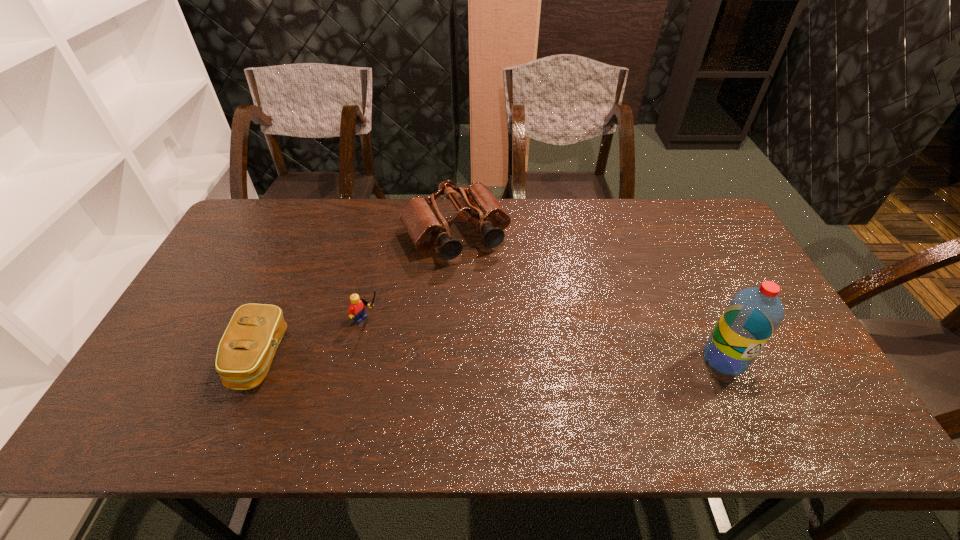
This screenshot has width=960, height=540. Find the location of `the leftmost object`. the leftmost object is located at coordinates (246, 350).

Where is `clutch bag`? The width and height of the screenshot is (960, 540). clutch bag is located at coordinates (246, 350).

You are a GUI agent. You are given a task and a screenshot of the screen. Output one action in this format:
    pyautogui.click(x=<x>, y=<y>)
    Task: Click on the tallest object
    This screenshot has width=960, height=540.
    Given the screenshot: What is the action you would take?
    pyautogui.click(x=752, y=316)

Locate an element on the screen. This screenshot has height=540, width=960. water bottle is located at coordinates [x=752, y=316].

The width and height of the screenshot is (960, 540). I want to click on binoculars, so click(x=426, y=226).

Identify the location of the farthest object. This screenshot has height=540, width=960. (426, 226).

Locate an element on the screen. Image resolution: width=960 pixels, height=540 pixels. the third tallest object is located at coordinates (356, 310).

Locate an element on the screen. The image size is (960, 540). the second object from left to right is located at coordinates (356, 310).

Where is `vacant space positioned 0.120m on the zipper side of the shortest object`? vacant space positioned 0.120m on the zipper side of the shortest object is located at coordinates (188, 357).

Locate an element on the screen. The height and width of the screenshot is (540, 960). vacant space located 0.130m on the zipper side of the shortest object is located at coordinates (184, 357).